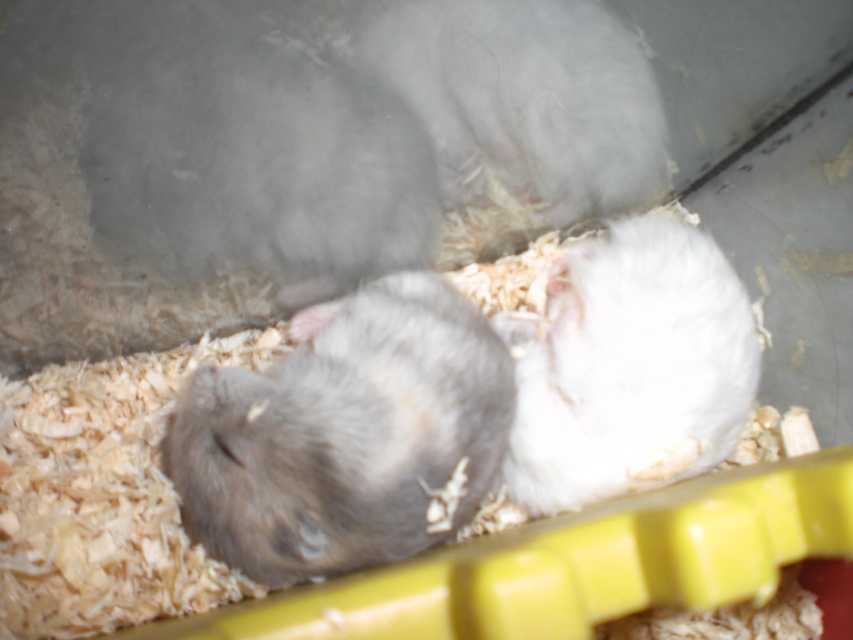
Question: Does gray fur hamster at center have a smaller size compared to white fluffy hamster at right?

Choices:
 (A) yes
 (B) no

Answer: (B)

Question: Can you confirm if gray fur hamster at center is bigger than white fluffy hamster at right?

Choices:
 (A) no
 (B) yes

Answer: (B)

Question: Which point appears farthest from the camera in this image?

Choices:
 (A) (497, 440)
 (B) (579, 368)

Answer: (B)

Question: Which point is farther from the camera taking this photo?

Choices:
 (A) (463, 426)
 (B) (693, 252)

Answer: (B)

Question: Does gray fur hamster at center lie in front of white fluffy hamster at right?

Choices:
 (A) yes
 (B) no

Answer: (A)